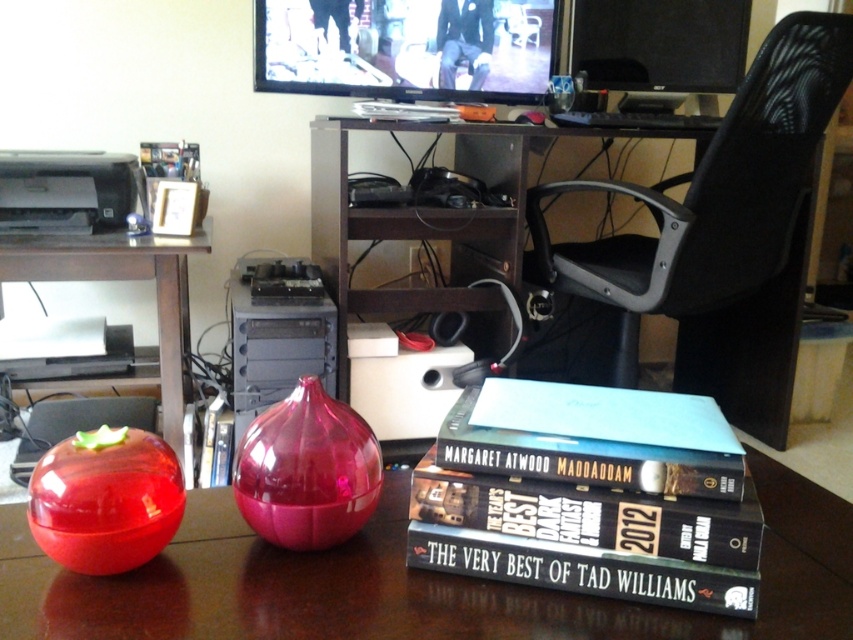
You are organizing items on the desk and need to place both the transparent plastic table at center and the black matte book at center. Given their sizes, which one can you place first without needing to adjust the other?

The transparent plastic table at center has a larger size compared to black matte book at center, so you can place the transparent plastic table at center first without needing to adjust the black matte book at center.

You are a delivery robot that is 0.8 meters wide. You need to move from the transparent plastic table at center to the black mesh computer chair at upper right. Is there enough space for you to pass through the area between them?

The transparent plastic table at center is 1.09 meters away from the black mesh computer chair at upper right, so yes, the robot can pass through the area between them since the distance is greater than the robot width of 0.8 meters.

You are organizing items on a desk and need to place a small paperweight. The transparent plastic table at center and the black matte book at center are in your way. Which object should you move to make space?

You should move the transparent plastic table at center because it is above the black matte book at center, so removing it first would free up space.